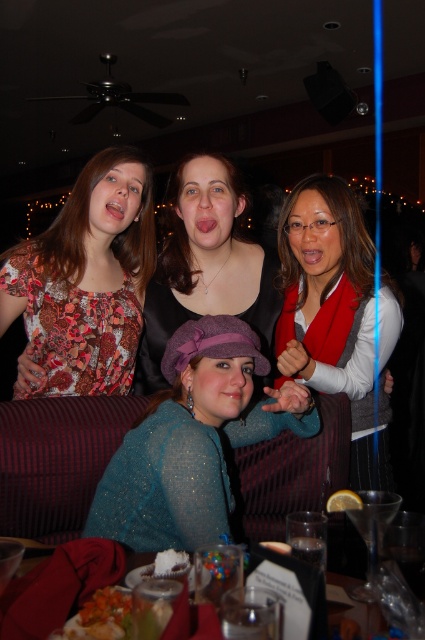
You are a photographer trying to adjust the lighting for a group photo. You notice two items in the scene that might reflect light differently due to their surface finishes. Which object, the sparkly teal sweater at center or the matte red scarf at center, is shorter in height?

The sparkly teal sweater at center is shorter in height compared to the matte red scarf at center.

You are at a party and want to take a photo with both the sparkly teal sweater at center and the matte black top at center. Since you want both to be visible in the photo, will you need to adjust your position to ensure both are in frame?

The sparkly teal sweater at center is in front of the matte black top at center, so you may need to adjust your angle or move slightly to ensure both are fully visible in the photo without one blocking the other.

You are organizing a photo shoot and need to ensure that the sparkly teal sweater at center and the matte black top at center fit within a 1.2 meter wide frame. Given their widths, will both items fit side by side without overlapping?

The sparkly teal sweater at center has a larger width than the matte black top at center. Since the total width of both items combined exceeds 1.2 meters, they cannot fit side by side without overlapping within the frame.